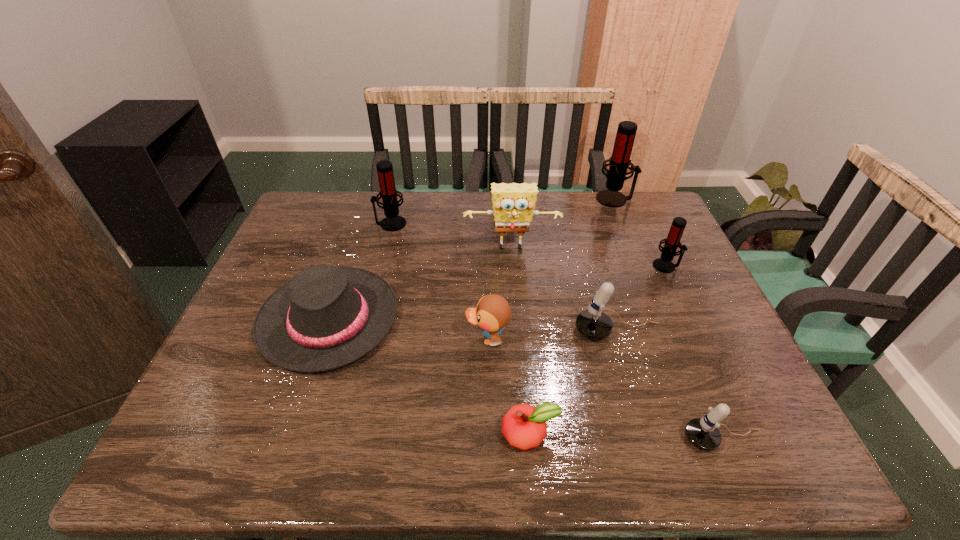
Identify the location of free space located on the front of the third farthest microphone. The image size is (960, 540). (683, 301).

The height and width of the screenshot is (540, 960). What are the coordinates of `vacant area located 0.180m on the front-facing side of the duck` in the screenshot? It's located at (392, 339).

This screenshot has height=540, width=960. I want to click on vacant space located 0.150m on the front-facing side of the duck, so click(x=404, y=339).

Find the location of a particular element. free space located 0.280m on the front-facing side of the duck is located at coordinates (351, 339).

Identify the location of vacant space located 0.060m on the right of the black dress hat. The height and width of the screenshot is (540, 960). (x=420, y=320).

This screenshot has width=960, height=540. In order to click on vacant point located 0.140m on the left of the shortest microphone in this screenshot , I will do `click(613, 439)`.

Locate an element on the screen. vacant region located 0.290m on the left of the apple is located at coordinates (358, 434).

This screenshot has width=960, height=540. What are the coordinates of `microphone positioned at the near edge` in the screenshot? It's located at (703, 433).

At what (x,y) coordinates should I click in order to perform the action: click on apple that is positioned at the near edge. Please return your answer as a coordinate pair (x, y). This screenshot has height=540, width=960. Looking at the image, I should click on (524, 426).

Identify the location of object that is positioned at the left edge. (325, 317).